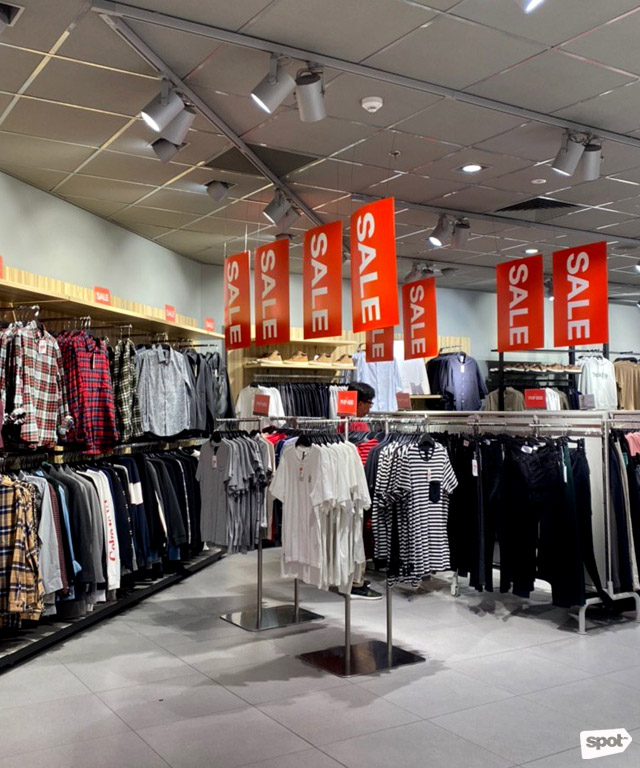
You are a GUI agent. You are given a task and a screenshot of the screen. Output one action in this format:
    pyautogui.click(x=<x>, y=<y>)
    Task: Click on the light fixtures
    The width and height of the screenshot is (640, 768).
    Given the screenshot: What is the action you would take?
    pyautogui.click(x=169, y=111), pyautogui.click(x=276, y=88), pyautogui.click(x=310, y=98), pyautogui.click(x=568, y=154), pyautogui.click(x=593, y=161), pyautogui.click(x=445, y=230), pyautogui.click(x=459, y=232), pyautogui.click(x=276, y=204), pyautogui.click(x=214, y=186)